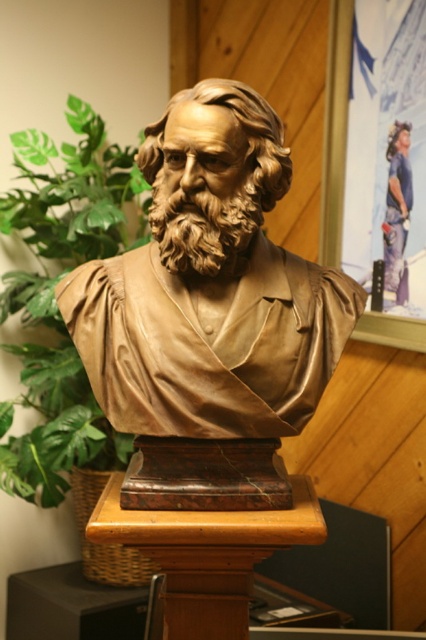
In the scene shown: You are an art curator arranging an exhibition. You have a bronze statue at center and a green leafy plant at center in the same display area. Based on their positions, which object is closer to the floor?

The bronze statue at center is below the green leafy plant at center, so the bronze statue at center is closer to the floor.

You are an interior designer assessing the placement of the bronze statue at center and the green leafy plant at center in a room. Based on their heights, which object would you recommend placing on a lower shelf to maintain visual balance?

The bronze statue at center has a lesser height compared to the green leafy plant at center. Therefore, the bronze statue at center should be placed on a lower shelf to balance the visual weight with the taller plant.

You are an interior designer arranging items in a room. You have a bronze statue at center and a green leafy plant at center. Which object takes up more space in the room?

The green leafy plant at center takes up more space than the bronze statue at center.